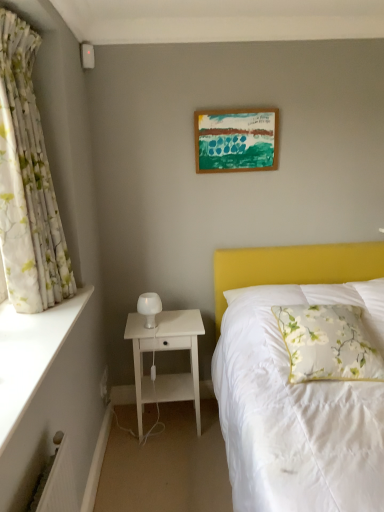
This screenshot has height=512, width=384. Find the location of `free space behind white frosted glass table lamp at left`. free space behind white frosted glass table lamp at left is located at coordinates (169, 315).